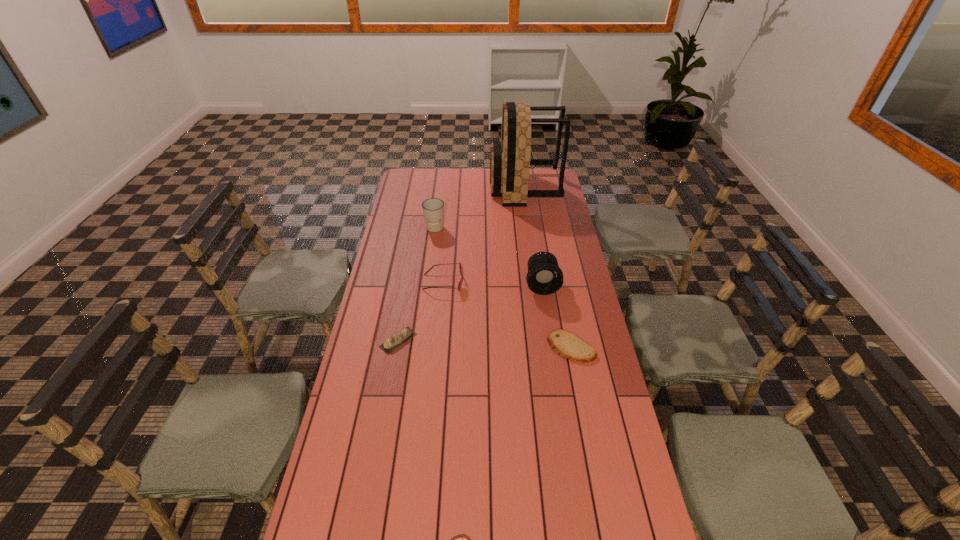
The width and height of the screenshot is (960, 540). What are the coordinates of `pita bread present at the right edge` in the screenshot? It's located at (566, 344).

Locate an element on the screen. This screenshot has width=960, height=540. object positioned at the far right corner is located at coordinates (510, 161).

Identify the location of vacant space at the far edge of the desktop. The image size is (960, 540). (435, 172).

At what (x,y) coordinates should I click in order to perform the action: click on vacant region at the left edge of the desktop. Please return your answer as a coordinate pair (x, y). The width and height of the screenshot is (960, 540). Looking at the image, I should click on (391, 241).

You are a GUI agent. You are given a task and a screenshot of the screen. Output one action in this format:
    pyautogui.click(x=<x>, y=<y>)
    Task: Click on the free space at the right edge of the desktop
    
    Given the screenshot: What is the action you would take?
    pyautogui.click(x=559, y=296)

Image resolution: width=960 pixels, height=540 pixels. Find the location of `free space at the far left corner`. free space at the far left corner is located at coordinates (427, 186).

Find the location of a particular element. This screenshot has width=960, height=540. blank region between the sixth nearest object and the rightmost pita bread is located at coordinates tap(503, 288).

Find the location of `vacant area that lies between the rightmost pita bread and the telephoto lens`. vacant area that lies between the rightmost pita bread and the telephoto lens is located at coordinates (557, 316).

Identify the location of vacant space that is in between the telephoto lens and the rightmost pita bread. (557, 316).

Where is `free space between the rightmost pita bread and the sixth nearest object`? free space between the rightmost pita bread and the sixth nearest object is located at coordinates [x=503, y=288].